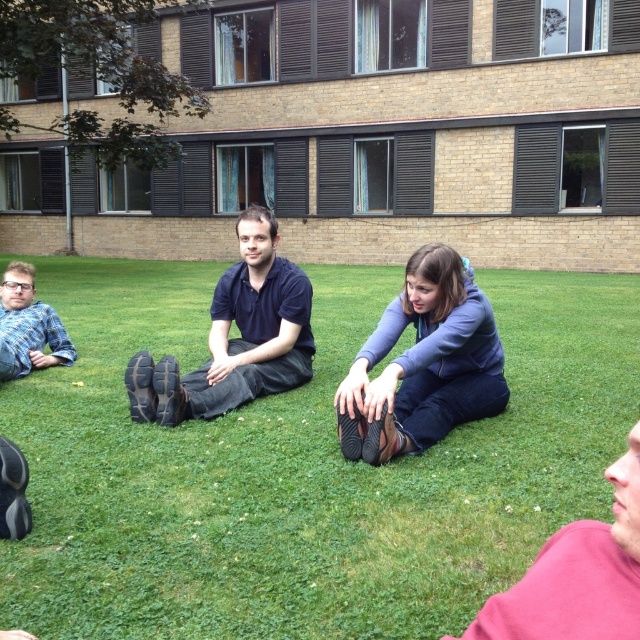
You are a photographer trying to capture a photo of the blue denim jeans at center and the blue plaid shirt at lower left. Which object should you focus on first if you want to ensure both are in the frame without moving the camera? Explain your reasoning based on their positions.

You should focus on the blue denim jeans at center first because it is taller than the blue plaid shirt at lower left. By centering the camera on the taller object, you can adjust the framing to include both items within the same shot without needing to reposition the camera.

From the picture: You are planning to set up a picnic blanket in the grassy area. The green grass at center is at coordinates point 0.730, 0.470. Is this the best spot to place the blanket so that it is centered on the grass?

The green grass at center is located at point (300,467), so placing the picnic blanket there would center it on the grass.

You are a photographer trying to capture a photo of the blue denim jeans at center and the pink fabric shirt at lower right. Based on their positions, which object should you focus on first to ensure both are in the frame?

The blue denim jeans at center is located above the pink fabric shirt at lower right, so you should focus on the blue denim jeans at center first to ensure both are in the frame.